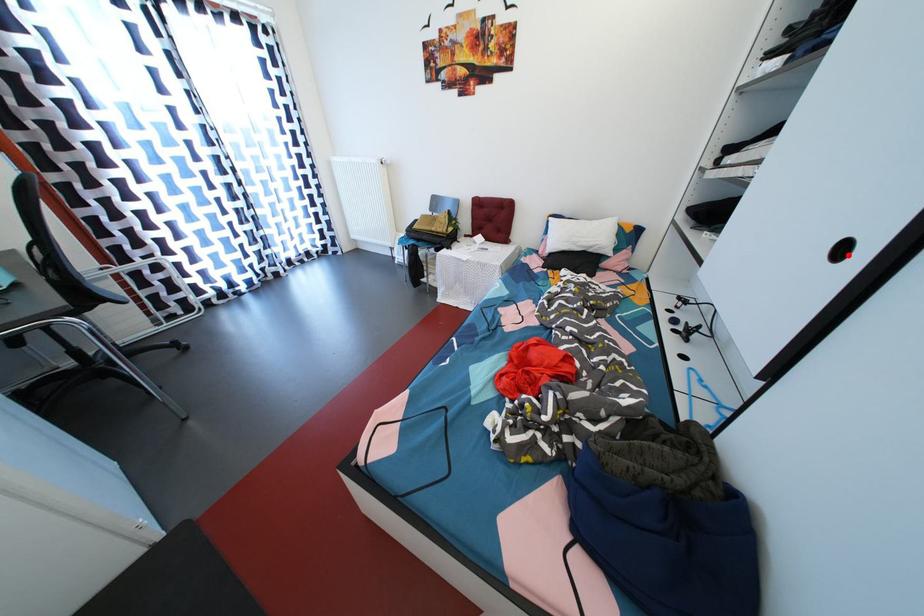
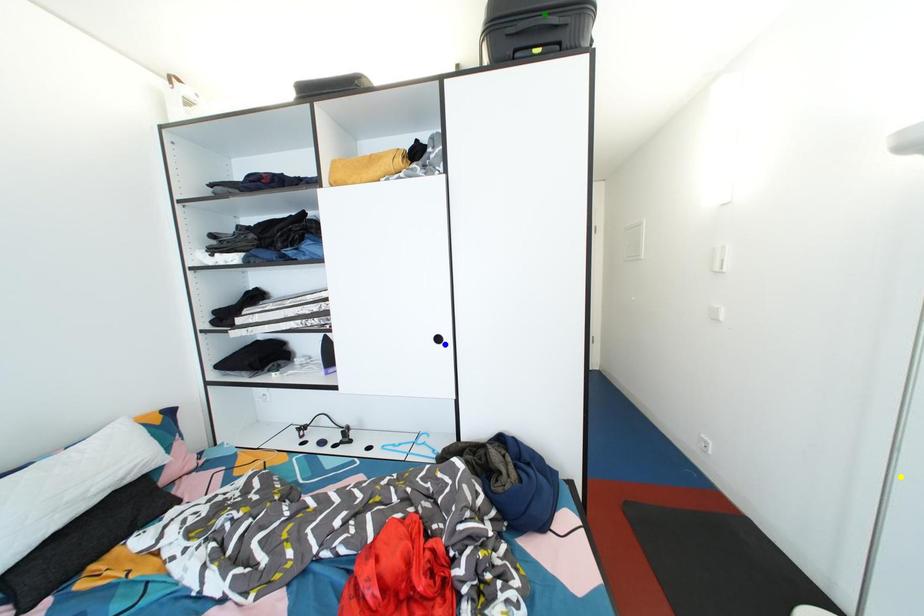
Question: I am providing you with two images of the same scene from different viewpoints. A red point is marked on the first image. You are given multiple points on the second image. Which mark in image 2 goes with the point in image 1?

Choices:
 (A) yellow point
 (B) green point
 (C) blue point

Answer: (C)